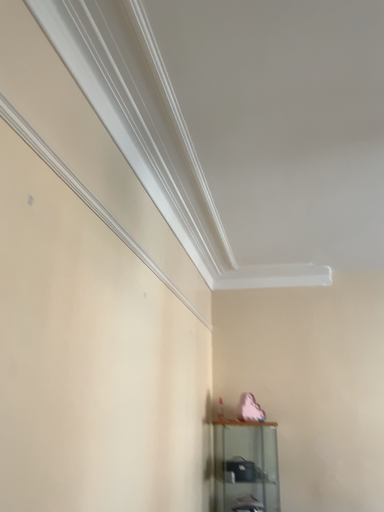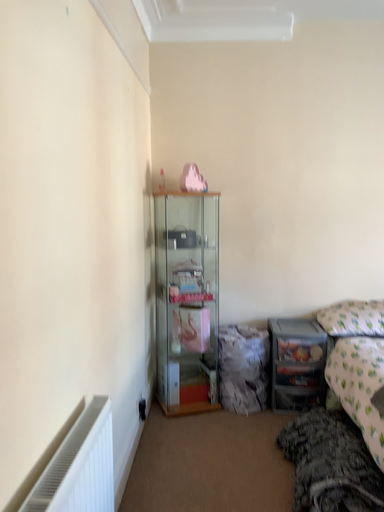
Question: Which way did the camera rotate in the video?

Choices:
 (A) rotated upward
 (B) rotated downward

Answer: (B)